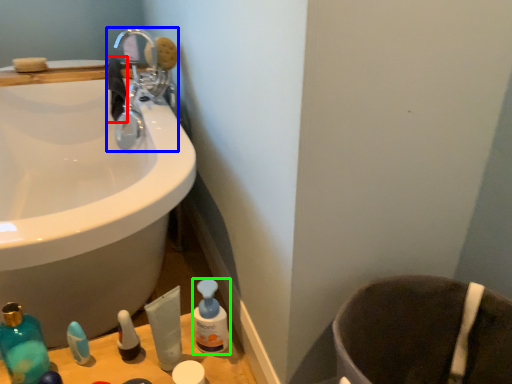
Question: Which is farther away from hand towel (highlighted by a red box)? tap (highlighted by a blue box) or cleaning product (highlighted by a green box)?

Choices:
 (A) tap
 (B) cleaning product

Answer: (B)